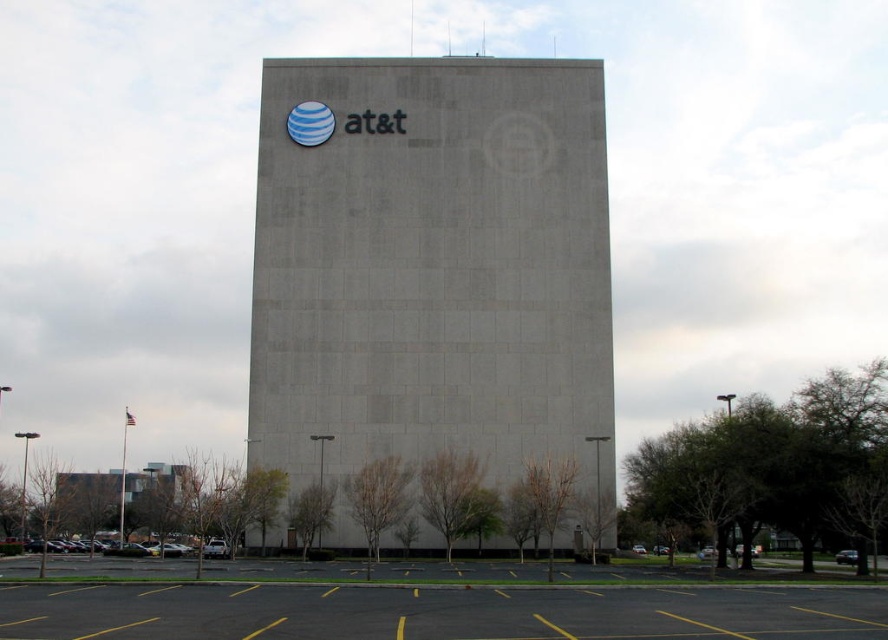
Question: Based on their relative distances, which object is farther from the gray asphalt parking lot at lower left?

Choices:
 (A) gray concrete building at center
 (B) yellow asphalt parking lot at lower center

Answer: (A)

Question: Which object appears farthest from the camera in this image?

Choices:
 (A) gray asphalt parking lot at lower left
 (B) gray concrete building at center
 (C) yellow asphalt parking lot at lower center

Answer: (B)

Question: Is gray concrete building at center smaller than gray asphalt parking lot at lower left?

Choices:
 (A) yes
 (B) no

Answer: (B)

Question: Among these objects, which one is farthest from the camera?

Choices:
 (A) gray concrete building at center
 (B) yellow asphalt parking lot at lower center

Answer: (A)

Question: Does gray concrete building at center have a lesser width compared to gray asphalt parking lot at lower left?

Choices:
 (A) yes
 (B) no

Answer: (B)

Question: Can you confirm if yellow asphalt parking lot at lower center is bigger than gray asphalt parking lot at lower left?

Choices:
 (A) yes
 (B) no

Answer: (A)